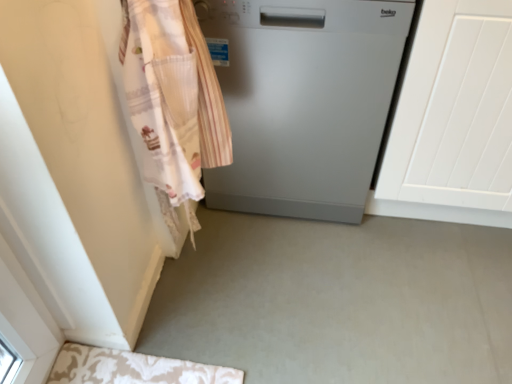
Question: Considering the positions of white textured door at right and white lace apron at left in the image, is white textured door at right bigger or smaller than white lace apron at left?

Choices:
 (A) small
 (B) big

Answer: (B)

Question: Is point (437, 102) positioned closer to the camera than point (193, 139)?

Choices:
 (A) closer
 (B) farther

Answer: (B)

Question: Considering the real-world distances, which object is farthest from the white textured door at right?

Choices:
 (A) satin silver dishwasher at center
 (B) white lace apron at left

Answer: (B)

Question: Which object is positioned closest to the satin silver dishwasher at center?

Choices:
 (A) white textured door at right
 (B) white lace apron at left

Answer: (A)